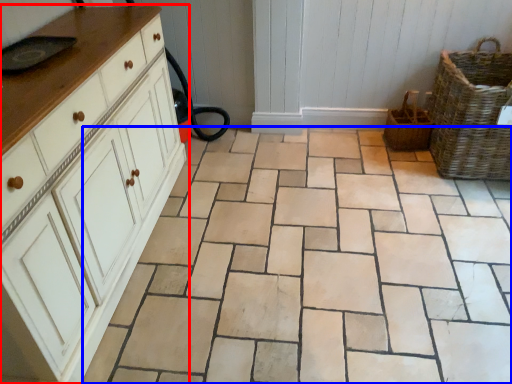
Question: Which object appears farthest to the camera in this image, chest of drawers (highlighted by a red box) or ceramic tile (highlighted by a blue box)?

Choices:
 (A) chest of drawers
 (B) ceramic tile

Answer: (B)